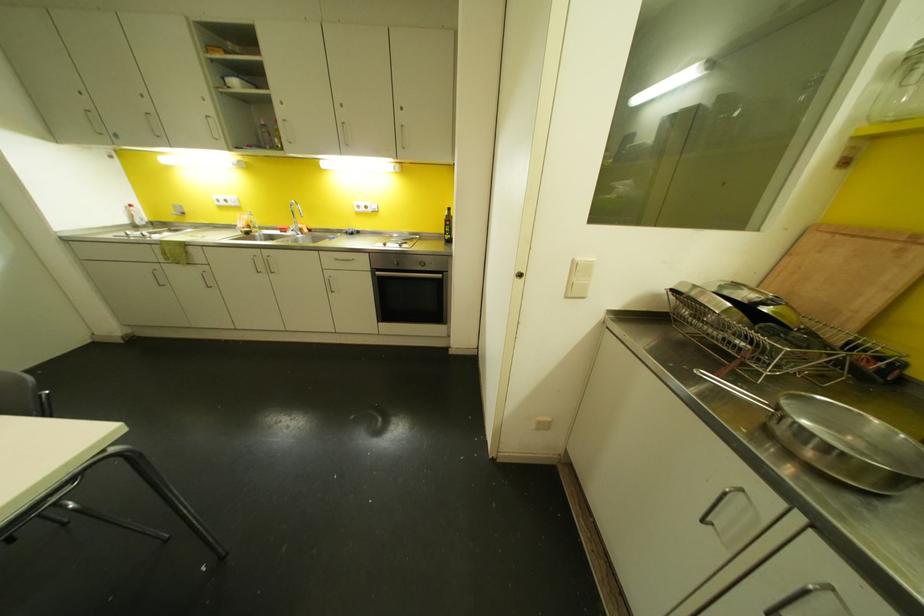
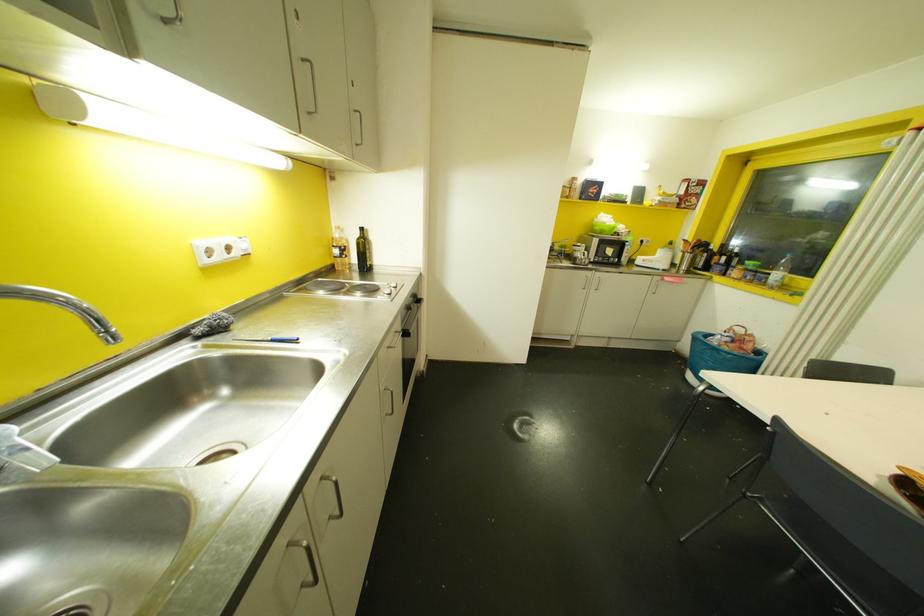
The point at (365,207) is marked in the first image. Where is the corresponding point in the second image?

(227, 248)